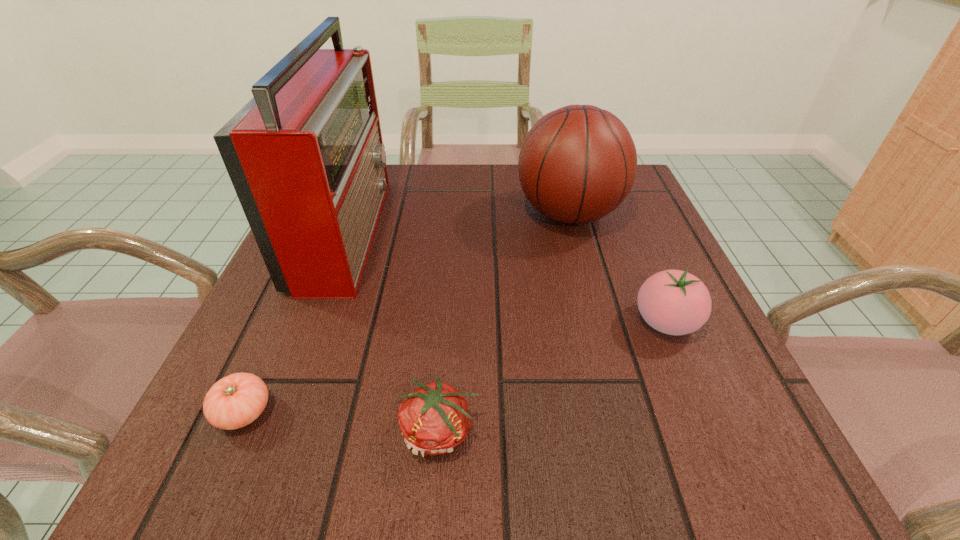
At what (x,y) coordinates should I click in order to perform the action: click on free region located 0.270m on the left of the third tallest object. Please return your answer as a coordinate pair (x, y). The image size is (960, 540). Looking at the image, I should click on (473, 322).

Image resolution: width=960 pixels, height=540 pixels. Find the location of `free space located 0.300m on the right of the second tallest tomato`. free space located 0.300m on the right of the second tallest tomato is located at coordinates (700, 431).

At what (x,y) coordinates should I click in order to perform the action: click on free space located 0.220m on the right of the shortest tomato. Please return your answer as a coordinate pair (x, y). Image resolution: width=960 pixels, height=540 pixels. Looking at the image, I should click on (428, 412).

Image resolution: width=960 pixels, height=540 pixels. Identify the location of radio receiver located at the far edge. (305, 155).

Locate an element on the screen. The height and width of the screenshot is (540, 960). basketball positioned at the far edge is located at coordinates (577, 164).

At what (x,y) coordinates should I click in order to perform the action: click on radio receiver positioned at the left edge. Please return your answer as a coordinate pair (x, y). Image resolution: width=960 pixels, height=540 pixels. Looking at the image, I should click on (305, 155).

Identify the location of tomato present at the left edge. (234, 401).

Find the location of a particular element. This screenshot has width=960, height=540. basketball that is at the right edge is located at coordinates (577, 164).

The height and width of the screenshot is (540, 960). Identify the location of tomato that is positioned at the right edge. (674, 302).

Locate an element on the screen. object located at the far left corner is located at coordinates (305, 155).